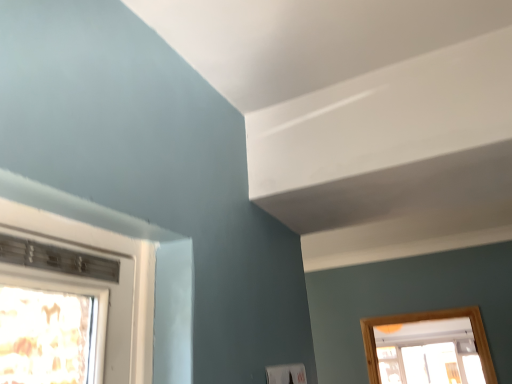
Where is `transparent glass window at lower right`? This screenshot has height=384, width=512. transparent glass window at lower right is located at coordinates (428, 348).

The height and width of the screenshot is (384, 512). What do you see at coordinates (428, 348) in the screenshot?
I see `transparent glass window at lower right` at bounding box center [428, 348].

Where is `transparent glass window at lower right`? transparent glass window at lower right is located at coordinates (428, 348).